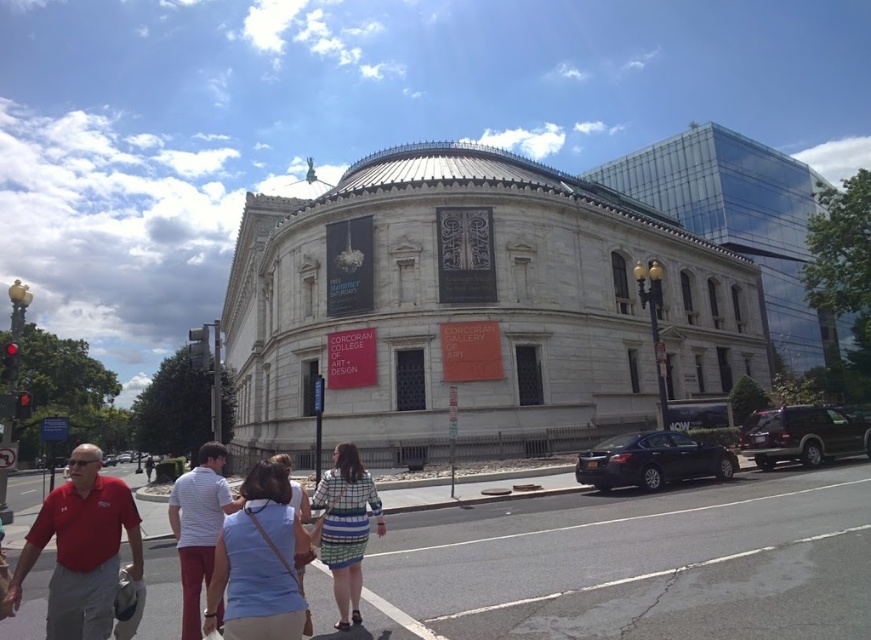
You are a photographer trying to capture the Corcoran Gallery of Art with both the striped fabric dress at center and the shiny black sedan at lower right in your shot. Which object should you focus on first to ensure both are in frame?

You should focus on the striped fabric dress at center first because it is larger in size compared to the shiny black sedan at lower right, ensuring it fits within the frame while the smaller sedan can be positioned accordingly.

You are a pedestrian standing at the center of the sidewalk in front of the Corcoran Gallery of Art. You notice a shiny black sedan at lower right and a light blue denim shirt at center. Which object is positioned to the right of the other?

The shiny black sedan at lower right is positioned to the right of the light blue denim shirt at center.

You are a photographer standing in front of the Corcoran Gallery of Art. You want to take a picture of the shiny black sedan at lower right and the white striped shirt at center. Which object is shorter in height?

The shiny black sedan at lower right is not as tall as the white striped shirt at center, so the shiny black sedan at lower right is shorter in height.